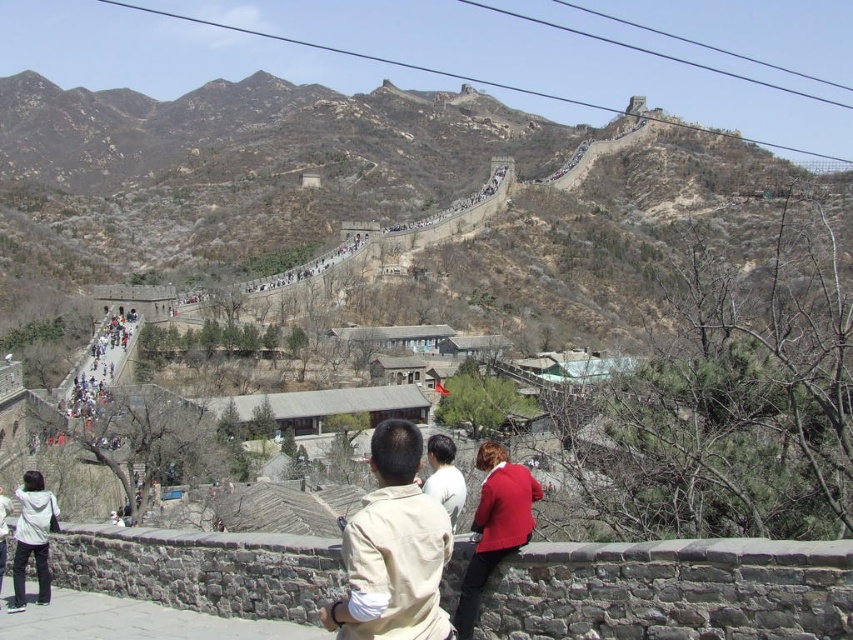
Is brown stone wall at upper center taller than red matte jacket at center?

Indeed, brown stone wall at upper center has a greater height compared to red matte jacket at center.

Who is lower down, brown stone wall at upper center or red matte jacket at center?

Positioned lower is red matte jacket at center.

Which is behind, point (341, 108) or point (463, 600)?

Point (341, 108)

Locate an element on the screen. The image size is (853, 640). brown stone wall at upper center is located at coordinates (234, 172).

Between point (485, 563) and point (456, 481), which one is positioned in front?

Positioned in front is point (485, 563).

Which is more to the right, red matte jacket at center or red wool coat at center?

red matte jacket at center

Between point (483, 532) and point (445, 497), which one is positioned in front?

Positioned in front is point (483, 532).

You are a GUI agent. You are given a task and a screenshot of the screen. Output one action in this format:
    pyautogui.click(x=<x>, y=<y>)
    Task: Click on the red matte jacket at center
    The width and height of the screenshot is (853, 640).
    Given the screenshot: What is the action you would take?
    pyautogui.click(x=495, y=525)

The height and width of the screenshot is (640, 853). Describe the element at coordinates (234, 172) in the screenshot. I see `brown stone wall at upper center` at that location.

Is brown stone wall at upper center bigger than beige fabric shirt at center?

Yes.

At what (x,y) coordinates should I click in order to perform the action: click on brown stone wall at upper center. Please return your answer as a coordinate pair (x, y). Looking at the image, I should click on (234, 172).